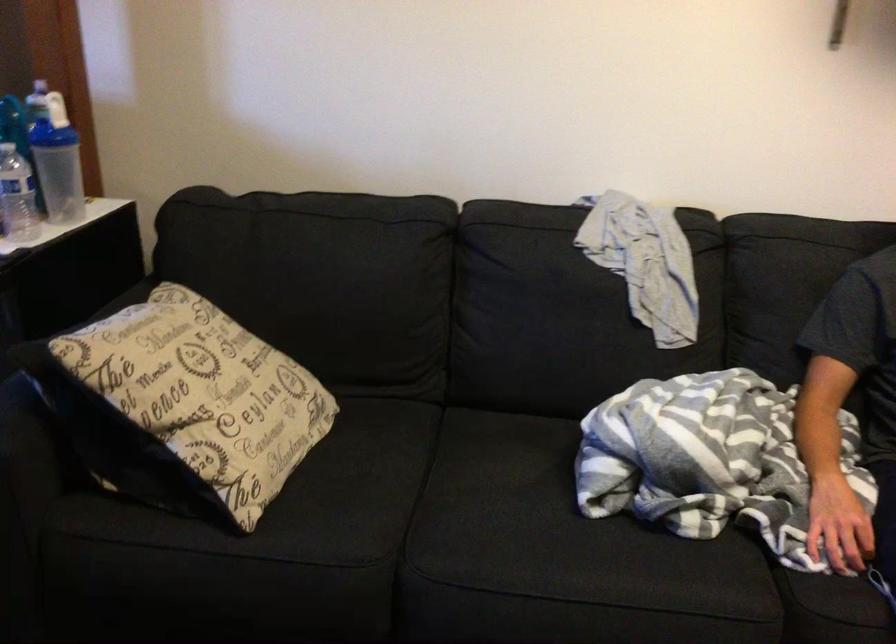
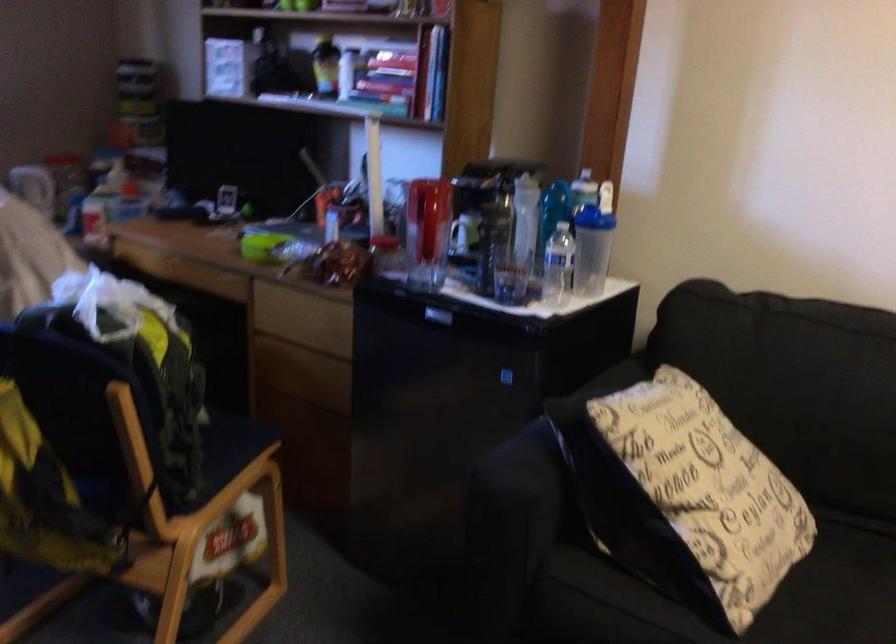
Question: The images are taken continuously from a first-person perspective. In which direction is your viewpoint rotating?

Choices:
 (A) Left
 (B) Right
 (C) Up
 (D) Down

Answer: (A)